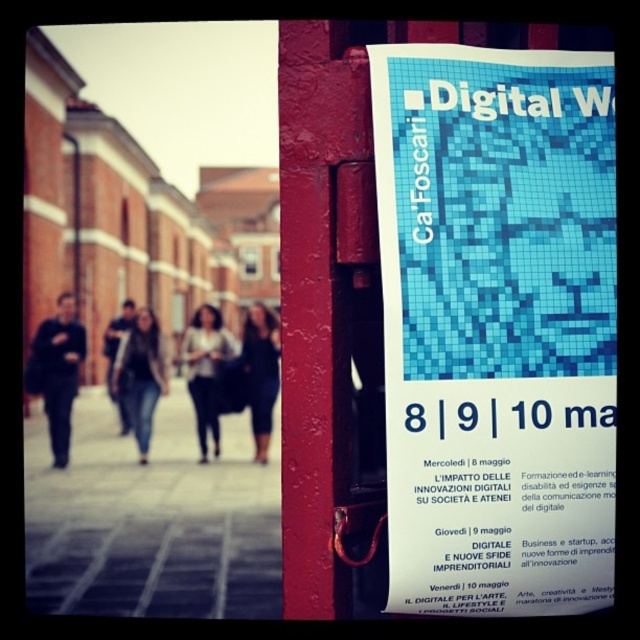
You are a delivery person who needs to place a box on the gray concrete pavement at lower center. However, there is a blue mosaic poster at right nearby. Where exactly should you place the box so it doesn not interfere with the poster?

The blue mosaic poster at right is above the gray concrete pavement at lower center, so placing the box on the gray concrete pavement at lower center would be under the poster. To avoid interference, place the box on the gray concrete pavement at lower center but ensure it is positioned away from the area directly under the blue mosaic poster at right.